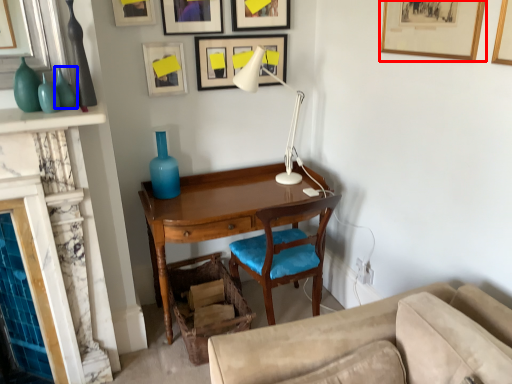
Question: Which object is closer to the camera taking this photo, picture frame (highlighted by a red box) or glass vase (highlighted by a blue box)?

Choices:
 (A) picture frame
 (B) glass vase

Answer: (A)